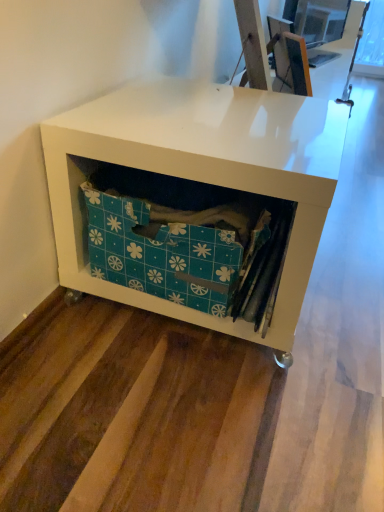
Question: Considering the positions of teal fabric storage box at center and white matte storage unit at lower left in the image, is teal fabric storage box at center taller or shorter than white matte storage unit at lower left?

Choices:
 (A) short
 (B) tall

Answer: (A)

Question: Is teal fabric storage box at center bigger or smaller than white matte storage unit at lower left?

Choices:
 (A) small
 (B) big

Answer: (A)

Question: Looking at their shapes, would you say teal fabric storage box at center is wider or thinner than white matte storage unit at lower left?

Choices:
 (A) wide
 (B) thin

Answer: (B)

Question: Does point (192, 86) appear closer or farther from the camera than point (170, 247)?

Choices:
 (A) farther
 (B) closer

Answer: (A)

Question: From their relative heights in the image, would you say white matte storage unit at lower left is taller or shorter than teal fabric storage box at center?

Choices:
 (A) tall
 (B) short

Answer: (A)

Question: Looking at their shapes, would you say white matte storage unit at lower left is wider or thinner than teal fabric storage box at center?

Choices:
 (A) thin
 (B) wide

Answer: (B)

Question: Considering their positions, is white matte storage unit at lower left located in front of or behind teal fabric storage box at center?

Choices:
 (A) behind
 (B) front

Answer: (B)